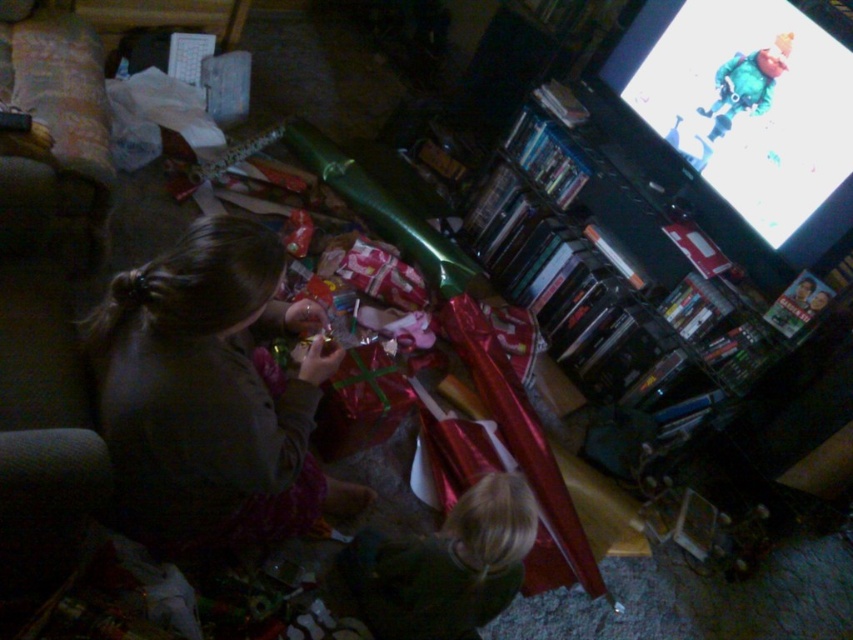
Does point (194, 289) come behind point (480, 579)?

That is False.

Where is `dark gray sweater at center`? The width and height of the screenshot is (853, 640). dark gray sweater at center is located at coordinates [x=212, y=396].

Find the location of a particular element. This screenshot has height=640, width=853. dark gray sweater at center is located at coordinates [212, 396].